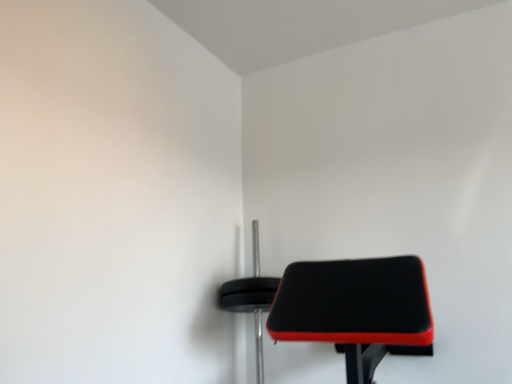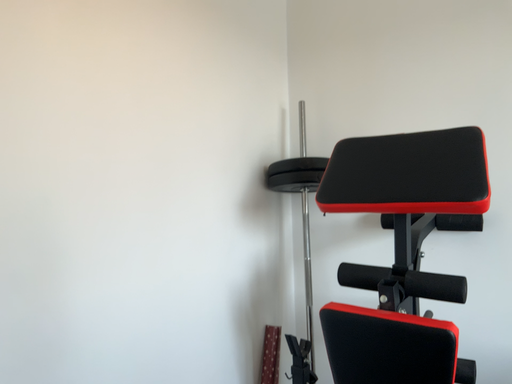
Question: Which way did the camera rotate in the video?

Choices:
 (A) rotated downward
 (B) rotated upward

Answer: (A)